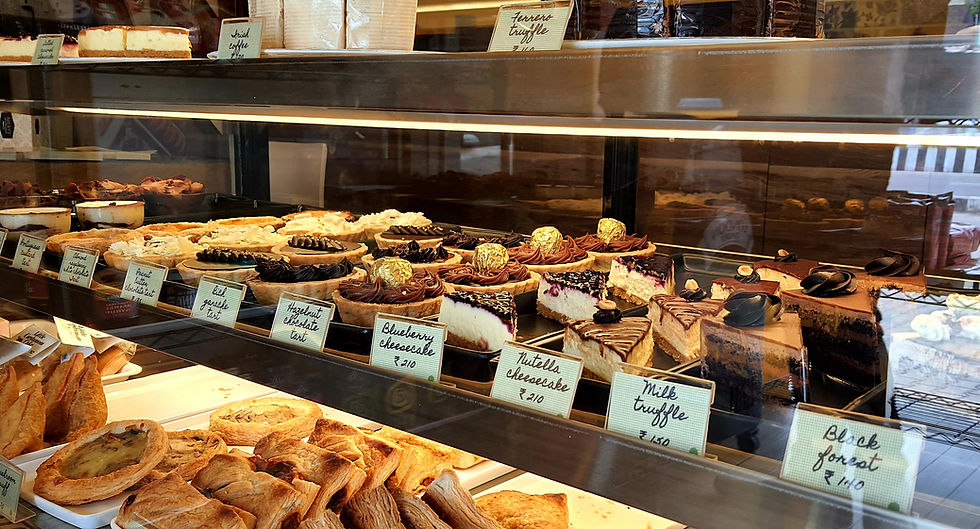
You are a GUI agent. You are given a task and a screenshot of the screen. Output one action in this format:
    pyautogui.click(x=<x>, y=<y>)
    Task: Click on the top shelf
    This screenshot has width=980, height=529.
    Given the screenshot: What is the action you would take?
    pyautogui.click(x=504, y=448)